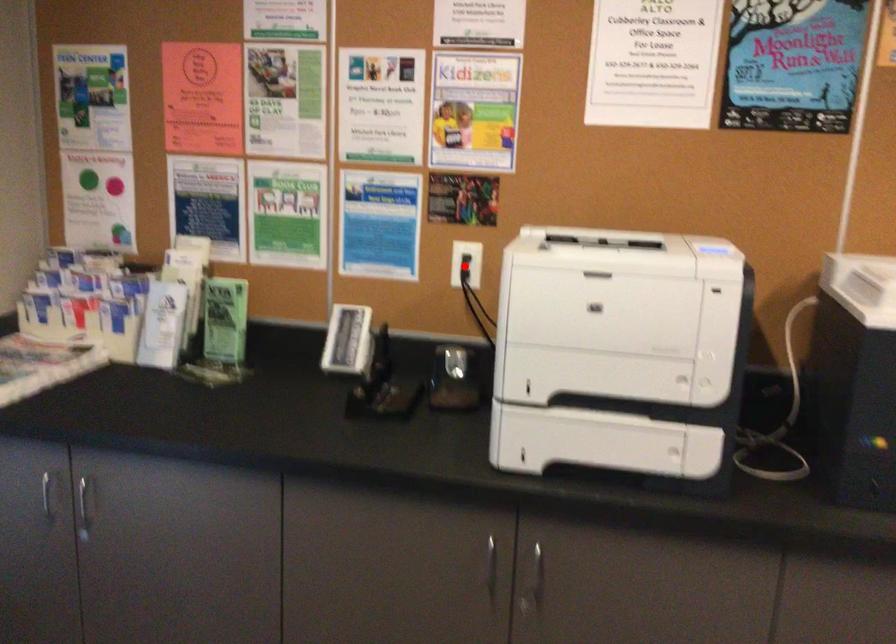
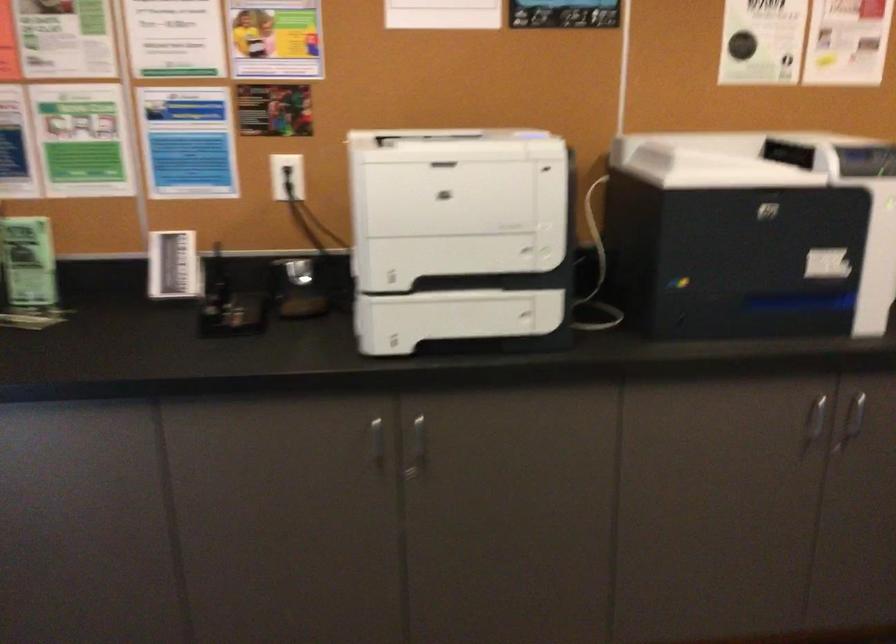
Find the pixel in the second image that matches the highlighted location in the first image.

(287, 176)